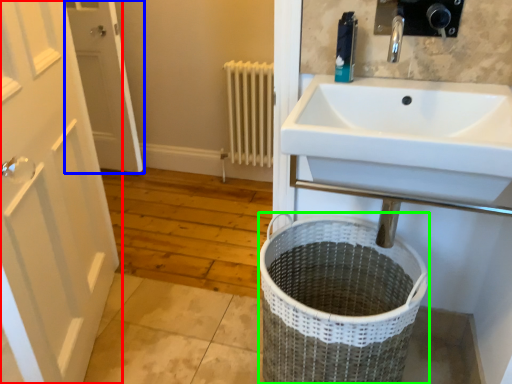
Question: Which is farther away from door (highlighted by a red box)? door (highlighted by a blue box) or laundry basket (highlighted by a green box)?

Choices:
 (A) door
 (B) laundry basket

Answer: (A)